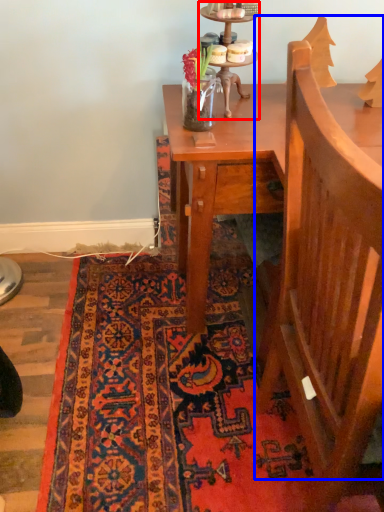
Question: Among these objects, which one is nearest to the camera, candle holder (highlighted by a red box) or armchair (highlighted by a blue box)?

Choices:
 (A) candle holder
 (B) armchair

Answer: (B)